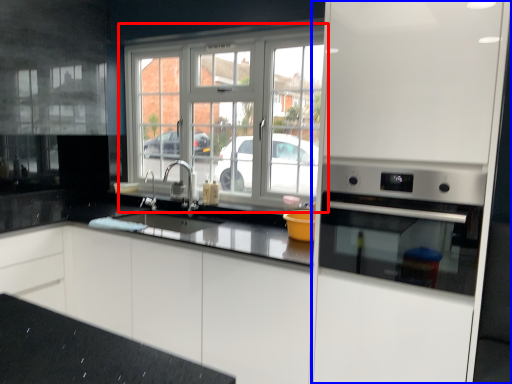
Question: Which point is further to the camera, window (highlighted by a red box) or appliance (highlighted by a blue box)?

Choices:
 (A) window
 (B) appliance

Answer: (A)